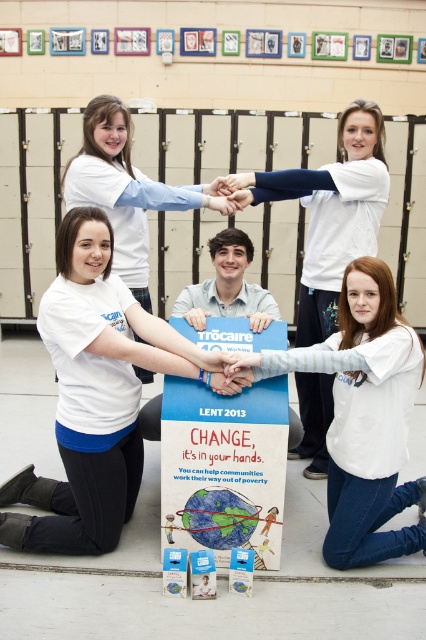
You are standing in front of the lockers and want to locate the white cotton shirt at upper center. According to the coordinates provided, where should you look relative to the lockers?

You should look at point 0.333 on the horizontal axis and 0.777 on the vertical axis relative to the lockers to find the white cotton shirt at upper center.